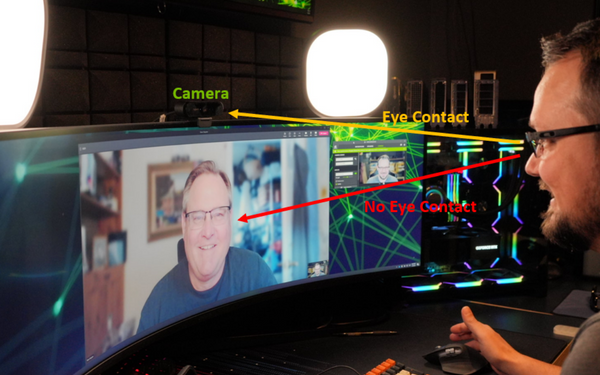
Locate an element on the screen. This screenshot has width=600, height=375. lights is located at coordinates (331, 67), (16, 62).